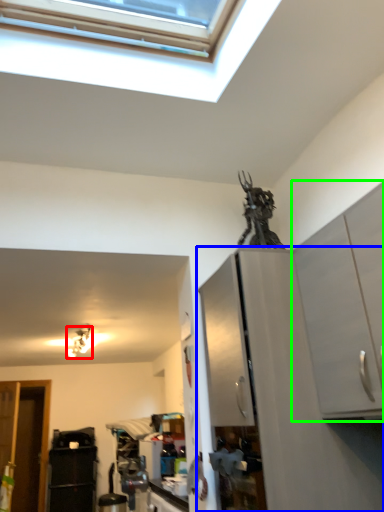
Question: Which object is positioned farthest from light fixture (highlighted by a red box)? Select from cabinetry (highlighted by a blue box) and cabinetry (highlighted by a green box).

Choices:
 (A) cabinetry
 (B) cabinetry

Answer: (B)